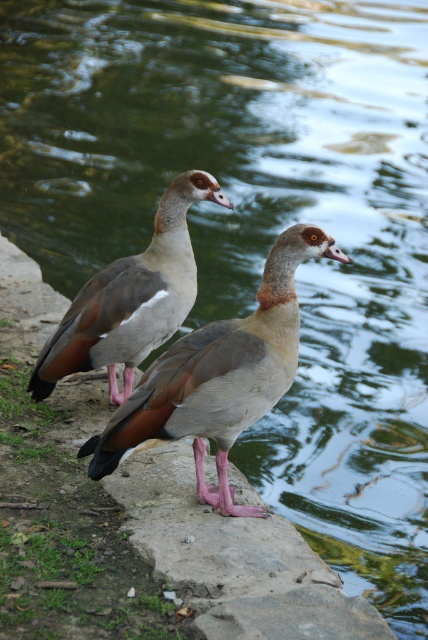
Does brown matte goose at center appear under brown matte goose at upper left?

Indeed, brown matte goose at center is positioned under brown matte goose at upper left.

Who is positioned more to the left, brown matte goose at center or brown matte goose at upper left?

Positioned to the left is brown matte goose at upper left.

In the scene shown: Who is more distant from viewer, (238, 374) or (163, 307)?

Point (163, 307)

Locate an element on the screen. Image resolution: width=428 pixels, height=640 pixels. brown matte goose at center is located at coordinates (219, 376).